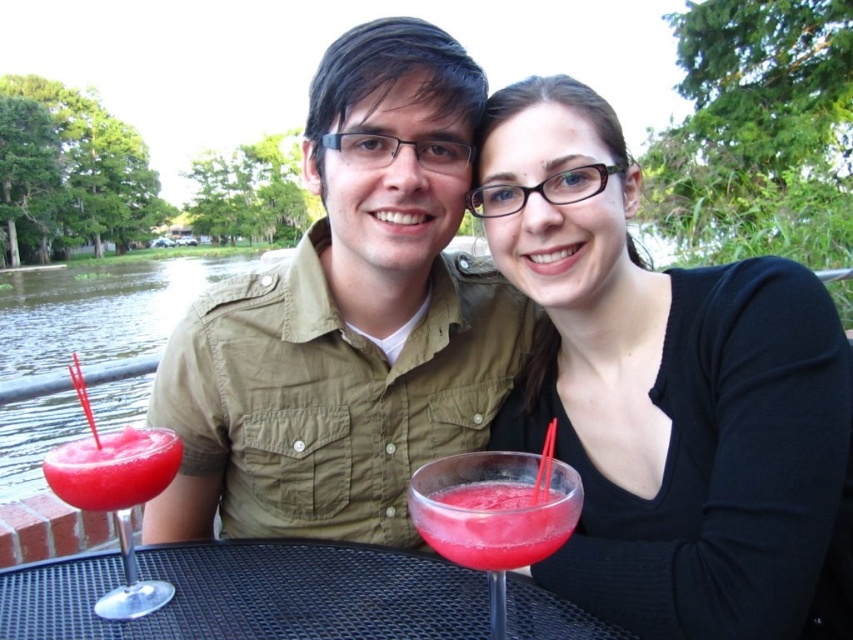
Question: Can you confirm if matte black shirt at center is smaller than matte khaki shirt at center?

Choices:
 (A) yes
 (B) no

Answer: (A)

Question: Is translucent glass drink at center thinner than smooth red drink at lower left?

Choices:
 (A) no
 (B) yes

Answer: (B)

Question: Which object is the closest to the matte khaki shirt at center?

Choices:
 (A) black mesh table at center
 (B) translucent glass drink at center

Answer: (A)

Question: Based on their relative distances, which object is farther from the black mesh table at center?

Choices:
 (A) matte khaki shirt at center
 (B) translucent pink drink at center
 (C) translucent glass drink at center
 (D) smooth pink slushie at left

Answer: (A)

Question: Which is farther from the translucent pink drink at center?

Choices:
 (A) matte black shirt at center
 (B) black mesh table at center
 (C) matte khaki shirt at center
 (D) smooth pink slushie at left

Answer: (C)

Question: Can you confirm if black mesh table at center is wider than smooth pink slushie at left?

Choices:
 (A) no
 (B) yes

Answer: (B)